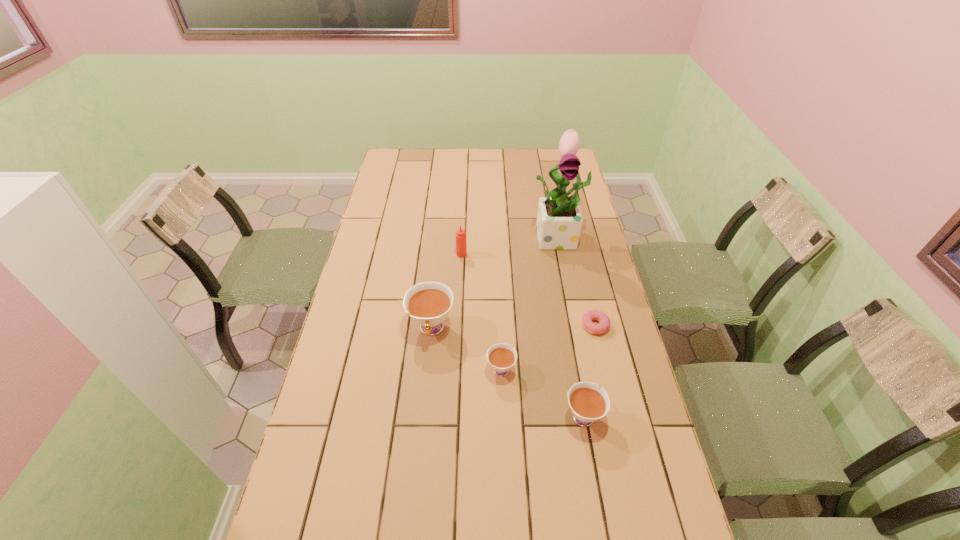
This screenshot has height=540, width=960. I want to click on flower arrangement present at the right edge, so click(x=559, y=220).

The height and width of the screenshot is (540, 960). I want to click on doughnut positioned at the right edge, so click(604, 322).

In the image, there is a desktop. At what (x,y) coordinates should I click in order to perform the action: click on vacant space at the far edge. Please return your answer as a coordinate pair (x, y). Looking at the image, I should click on (491, 165).

In the image, there is a desktop. At what (x,y) coordinates should I click in order to perform the action: click on free space at the near edge. Please return your answer as a coordinate pair (x, y). The width and height of the screenshot is (960, 540). Looking at the image, I should click on (497, 534).

This screenshot has height=540, width=960. What are the coordinates of `vacant area at the left edge of the desktop` in the screenshot? It's located at (384, 238).

In the image, there is a desktop. Identify the location of free space at the right edge. (614, 322).

Locate an element on the screen. free space that is in between the Tabasco sauce and the nearest object is located at coordinates (522, 334).

Locate an element on the screen. unoccupied position between the doughnut and the fifth farthest object is located at coordinates (548, 347).

The height and width of the screenshot is (540, 960). I want to click on vacant space in between the flower arrangement and the third shortest object, so 571,326.

The image size is (960, 540). Identify the location of empty space between the fifth farthest object and the doughnut. (548, 347).